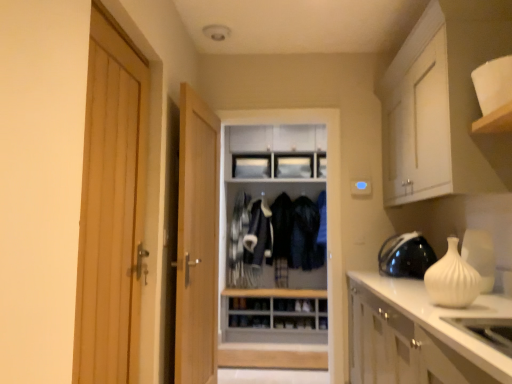
Question: Which direction should I rotate to face light wood door at center, positioned as the first door in right-to-left order, — up or down?

Choices:
 (A) down
 (B) up

Answer: (A)

Question: Is white glossy countertop at lower right, marked as the second cabinetry in a top-to-bottom arrangement, inside white matte vase at right?

Choices:
 (A) no
 (B) yes

Answer: (A)

Question: Can you confirm if white matte vase at right is taller than white glossy countertop at lower right, the first cabinetry from the bottom?

Choices:
 (A) no
 (B) yes

Answer: (A)

Question: Can you confirm if white matte vase at right is positioned to the right of white glossy countertop at lower right, the first cabinetry from the bottom?

Choices:
 (A) yes
 (B) no

Answer: (B)

Question: Is white glossy countertop at lower right, the first cabinetry from the bottom, at the back of white matte vase at right?

Choices:
 (A) yes
 (B) no

Answer: (B)

Question: From a real-world perspective, is white matte vase at right positioned over white glossy countertop at lower right, the first cabinetry from the bottom, based on gravity?

Choices:
 (A) yes
 (B) no

Answer: (A)

Question: From a real-world perspective, is white matte vase at right located beneath white glossy countertop at lower right, the first cabinetry from the bottom?

Choices:
 (A) yes
 (B) no

Answer: (B)

Question: Is white matte cabinet at upper right, which ranks as the 2th cabinetry in bottom-to-top order, far from dark blue fabric jacket at center, the first clothing when ordered from right to left?

Choices:
 (A) no
 (B) yes

Answer: (B)

Question: Could you tell me if white matte cabinet at upper right, which ranks as the 2th cabinetry in bottom-to-top order, is turned towards dark blue fabric jacket at center, the first clothing when ordered from right to left?

Choices:
 (A) yes
 (B) no

Answer: (B)

Question: Is white matte cabinet at upper right, acting as the first cabinetry starting from the top, closer to the viewer compared to dark blue fabric jacket at center, the first clothing when ordered from right to left?

Choices:
 (A) yes
 (B) no

Answer: (A)

Question: Does white matte cabinet at upper right, acting as the first cabinetry starting from the top, contain dark blue fabric jacket at center, acting as the second clothing starting from the left?

Choices:
 (A) no
 (B) yes

Answer: (A)

Question: From the image's perspective, is white matte cabinet at upper right, which ranks as the 2th cabinetry in bottom-to-top order, over dark blue fabric jacket at center, the first clothing when ordered from right to left?

Choices:
 (A) yes
 (B) no

Answer: (A)

Question: Is white matte cabinet at upper right, which ranks as the 2th cabinetry in bottom-to-top order, facing away from dark blue fabric jacket at center, acting as the second clothing starting from the left?

Choices:
 (A) no
 (B) yes

Answer: (A)

Question: From a real-world perspective, is light wood door at left, marked as the 2th door in a back-to-front arrangement, physically above black glossy helmet at right?

Choices:
 (A) no
 (B) yes

Answer: (B)